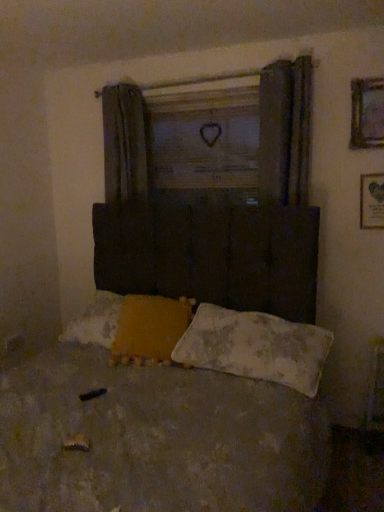
Looking at this image, measure the distance between white textured pillow at lower center, the 1th pillow from the right, and camera.

white textured pillow at lower center, the 1th pillow from the right, and camera are 1.87 meters apart from each other.

What do you see at coordinates (149, 329) in the screenshot? I see `yellow fabric pillow at lower center, the 2th pillow positioned from the right` at bounding box center [149, 329].

Identify the location of wooden framed picture at upper right, the second picture frame ordered from the bottom. (367, 113).

At what (x,y) coordinates should I click in order to perform the action: click on picture frame below the wooden framed picture at upper right, which is the first picture frame from top to bottom (from the image's perspective). Please return your answer as a coordinate pair (x, y). This screenshot has height=512, width=384. Looking at the image, I should click on (372, 201).

From the image's perspective, between wooden framed picture at upper right, the second picture frame ordered from the bottom, and wooden framed picture at upper right, arranged as the 2th picture frame when viewed from the top, who is located below?

wooden framed picture at upper right, arranged as the 2th picture frame when viewed from the top, from the image's perspective.

Can you tell me how much wooden framed picture at upper right, which is the first picture frame from top to bottom, and wooden framed picture at upper right, marked as the 1th picture frame in a bottom-to-top arrangement, differ in facing direction?

They differ by 0.442 degrees in their facing directions.

Are white textured pillow at lower center, the 1th pillow from the right, and worn fabric bed at center beside each other?

No, white textured pillow at lower center, the 1th pillow from the right, is not beside worn fabric bed at center.

How many degrees apart are the facing directions of white textured pillow at lower center, placed as the second pillow when sorted from left to right, and worn fabric bed at center?

There is a 0.418-degree angle between the facing directions of white textured pillow at lower center, placed as the second pillow when sorted from left to right, and worn fabric bed at center.

Considering the sizes of objects white textured pillow at lower center, placed as the second pillow when sorted from left to right, and worn fabric bed at center in the image provided, who is thinner, white textured pillow at lower center, placed as the second pillow when sorted from left to right, or worn fabric bed at center?

Thinner between the two is white textured pillow at lower center, placed as the second pillow when sorted from left to right.

Is worn fabric bed at center at the back of white textured pillow at lower center, placed as the second pillow when sorted from left to right?

Correct, white textured pillow at lower center, placed as the second pillow when sorted from left to right, is looking away from worn fabric bed at center.

From the image's perspective, which one is positioned higher, wooden framed picture at upper right, arranged as the 2th picture frame when viewed from the top, or yellow fabric pillow at lower center, placed as the first pillow when sorted from left to right?

From the image's view, wooden framed picture at upper right, arranged as the 2th picture frame when viewed from the top, is above.

From a real-world perspective, is wooden framed picture at upper right, arranged as the 2th picture frame when viewed from the top, over yellow fabric pillow at lower center, placed as the first pillow when sorted from left to right?

Yes.

Is wooden framed picture at upper right, marked as the 1th picture frame in a bottom-to-top arrangement, oriented towards yellow fabric pillow at lower center, placed as the first pillow when sorted from left to right?

No, wooden framed picture at upper right, marked as the 1th picture frame in a bottom-to-top arrangement, is not oriented towards yellow fabric pillow at lower center, placed as the first pillow when sorted from left to right.

Which is nearer, (x=382, y=185) or (x=215, y=461)?

Clearly, point (x=382, y=185) is more distant from the camera than point (x=215, y=461).

Is wooden framed picture at upper right, arranged as the 2th picture frame when viewed from the top, not close to worn fabric bed at center?

Yes, wooden framed picture at upper right, arranged as the 2th picture frame when viewed from the top, is far from worn fabric bed at center.

Can you confirm if wooden framed picture at upper right, arranged as the 2th picture frame when viewed from the top, is positioned to the left of worn fabric bed at center?

No, wooden framed picture at upper right, arranged as the 2th picture frame when viewed from the top, is not to the left of worn fabric bed at center.

Is wooden heart at center oriented towards wooden framed picture at upper right, marked as the 1th picture frame in a bottom-to-top arrangement?

No, wooden heart at center is not turned towards wooden framed picture at upper right, marked as the 1th picture frame in a bottom-to-top arrangement.

Is wooden heart at center to the right of wooden framed picture at upper right, marked as the 1th picture frame in a bottom-to-top arrangement, from the viewer's perspective?

No.

From the image's perspective, is wooden heart at center over wooden framed picture at upper right, arranged as the 2th picture frame when viewed from the top?

Yes, from the image's perspective, wooden heart at center is on top of wooden framed picture at upper right, arranged as the 2th picture frame when viewed from the top.

Considering the sizes of objects wooden heart at center and wooden framed picture at upper right, marked as the 1th picture frame in a bottom-to-top arrangement, in the image provided, who is bigger, wooden heart at center or wooden framed picture at upper right, marked as the 1th picture frame in a bottom-to-top arrangement,?

wooden heart at center is bigger.

From a real-world perspective, is wooden heart at center located higher than worn fabric bed at center?

Yes.

Is wooden heart at center taller or shorter than worn fabric bed at center?

wooden heart at center is shorter than worn fabric bed at center.

Considering the positions of point (210, 179) and point (64, 496), is point (210, 179) closer or farther from the camera than point (64, 496)?

Point (210, 179).

Can you confirm if wooden heart at center is smaller than worn fabric bed at center?

Indeed, wooden heart at center has a smaller size compared to worn fabric bed at center.

In the scene shown: From the image's perspective, does wooden heart at center appear lower than yellow fabric pillow at lower center, the 2th pillow positioned from the right?

Actually, wooden heart at center appears above yellow fabric pillow at lower center, the 2th pillow positioned from the right, in the image.

Does wooden heart at center have a lesser width compared to yellow fabric pillow at lower center, the 2th pillow positioned from the right?

Yes, wooden heart at center is thinner than yellow fabric pillow at lower center, the 2th pillow positioned from the right.

Considering the sizes of objects wooden heart at center and yellow fabric pillow at lower center, placed as the first pillow when sorted from left to right, in the image provided, who is bigger, wooden heart at center or yellow fabric pillow at lower center, placed as the first pillow when sorted from left to right,?

With larger size is yellow fabric pillow at lower center, placed as the first pillow when sorted from left to right.

Is wooden heart at center outside of yellow fabric pillow at lower center, the 2th pillow positioned from the right?

Indeed, wooden heart at center is completely outside yellow fabric pillow at lower center, the 2th pillow positioned from the right.

You are a GUI agent. You are given a task and a screenshot of the screen. Output one action in this format:
    pyautogui.click(x=<x>, y=<y>)
    Task: Click on the picture frame above the wooden framed picture at upper right, arranged as the 2th picture frame when viewed from the top (from the image's perspective)
    
    Given the screenshot: What is the action you would take?
    pyautogui.click(x=367, y=113)

At what (x,y) coordinates should I click in order to perform the action: click on pillow below the worn fabric bed at center (from a real-world perspective). Please return your answer as a coordinate pair (x, y). The height and width of the screenshot is (512, 384). Looking at the image, I should click on (255, 347).

Based on their spatial positions, is white textured pillow at lower center, placed as the second pillow when sorted from left to right, or wooden framed picture at upper right, the second picture frame ordered from the bottom, closer to yellow fabric pillow at lower center, placed as the first pillow when sorted from left to right?

Among the two, white textured pillow at lower center, placed as the second pillow when sorted from left to right, is located nearer to yellow fabric pillow at lower center, placed as the first pillow when sorted from left to right.

Which object lies nearer to the anchor point wooden framed picture at upper right, arranged as the 2th picture frame when viewed from the top, worn fabric bed at center or yellow fabric pillow at lower center, the 2th pillow positioned from the right?

yellow fabric pillow at lower center, the 2th pillow positioned from the right, lies closer to wooden framed picture at upper right, arranged as the 2th picture frame when viewed from the top, than the other object.

Consider the image. Based on their spatial positions, is white textured pillow at lower center, the 1th pillow from the right, or yellow fabric pillow at lower center, placed as the first pillow when sorted from left to right, closer to wooden heart at center?

yellow fabric pillow at lower center, placed as the first pillow when sorted from left to right, lies closer to wooden heart at center than the other object.

Which object lies nearer to the anchor point worn fabric bed at center, yellow fabric pillow at lower center, the 2th pillow positioned from the right, or wooden framed picture at upper right, arranged as the 2th picture frame when viewed from the top?

yellow fabric pillow at lower center, the 2th pillow positioned from the right, is positioned closer to the anchor worn fabric bed at center.

Considering their positions, is wooden heart at center positioned closer to white textured pillow at lower center, the 1th pillow from the right, than wooden framed picture at upper right, arranged as the 2th picture frame when viewed from the top?

wooden framed picture at upper right, arranged as the 2th picture frame when viewed from the top, lies closer to white textured pillow at lower center, the 1th pillow from the right, than the other object.

Estimate the real-world distances between objects in this image. Which object is closer to yellow fabric pillow at lower center, placed as the first pillow when sorted from left to right, white textured pillow at lower center, placed as the second pillow when sorted from left to right, or worn fabric bed at center?

white textured pillow at lower center, placed as the second pillow when sorted from left to right.

Estimate the real-world distances between objects in this image. Which object is further from white textured pillow at lower center, placed as the second pillow when sorted from left to right, worn fabric bed at center or wooden framed picture at upper right, arranged as the 2th picture frame when viewed from the top?

Among the two, wooden framed picture at upper right, arranged as the 2th picture frame when viewed from the top, is located further to white textured pillow at lower center, placed as the second pillow when sorted from left to right.

Based on their spatial positions, is wooden framed picture at upper right, the second picture frame ordered from the bottom, or white textured pillow at lower center, placed as the second pillow when sorted from left to right, closer to worn fabric bed at center?

Based on the image, white textured pillow at lower center, placed as the second pillow when sorted from left to right, appears to be nearer to worn fabric bed at center.

The image size is (384, 512). I want to click on picture frame between worn fabric bed at center and wooden framed picture at upper right, arranged as the 2th picture frame when viewed from the top, in the front-back direction, so click(x=367, y=113).

Identify the location of picture frame between wooden framed picture at upper right, the second picture frame ordered from the bottom, and white textured pillow at lower center, placed as the second pillow when sorted from left to right, from top to bottom. The width and height of the screenshot is (384, 512). (372, 201).

Locate an element on the screen. pillow between wooden heart at center and white textured pillow at lower center, the 1th pillow from the right, in the up-down direction is located at coordinates coord(149,329).

What are the coordinates of `picture frame located between yellow fabric pillow at lower center, placed as the first pillow when sorted from left to right, and wooden framed picture at upper right, arranged as the 2th picture frame when viewed from the top, in the left-right direction` in the screenshot? It's located at click(x=367, y=113).